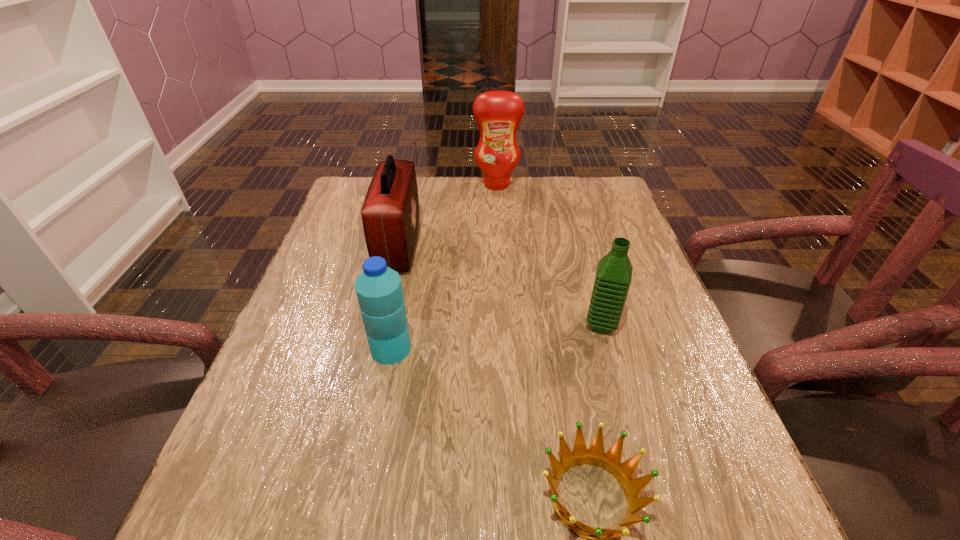
Locate an element on the screen. object at the left edge is located at coordinates (390, 214).

Find the location of a particular element. This screenshot has width=960, height=540. object located in the right edge section of the desktop is located at coordinates (613, 277).

Where is `free space at the far edge of the desktop`? The width and height of the screenshot is (960, 540). free space at the far edge of the desktop is located at coordinates (539, 181).

You are a GUI agent. You are given a task and a screenshot of the screen. Output one action in this format:
    pyautogui.click(x=<x>, y=<y>)
    Task: Click on the vacant area at the left edge
    
    Given the screenshot: What is the action you would take?
    pyautogui.click(x=347, y=279)

Identify the location of free region at the right edge of the desktop. Image resolution: width=960 pixels, height=540 pixels. (633, 307).

Image resolution: width=960 pixels, height=540 pixels. Find the location of `free space at the far right corner of the desktop`. free space at the far right corner of the desktop is located at coordinates (575, 206).

You are a GUI agent. You are given a task and a screenshot of the screen. Output one action in this format:
    pyautogui.click(x=<x>, y=<y>)
    Task: Click on the free space between the left water bottle and the condiment
    The width and height of the screenshot is (960, 540).
    Given the screenshot: What is the action you would take?
    pyautogui.click(x=444, y=267)

Image resolution: width=960 pixels, height=540 pixels. Identify the location of vacant area that lies between the left water bottle and the farthest object. (444, 267).

Where is `empty space between the tallest object and the left water bottle`? empty space between the tallest object and the left water bottle is located at coordinates (444, 267).

At what (x,y) coordinates should I click in order to perform the action: click on free space that is in between the left water bottle and the condiment. Please return your answer as a coordinate pair (x, y). Image resolution: width=960 pixels, height=540 pixels. Looking at the image, I should click on (444, 267).